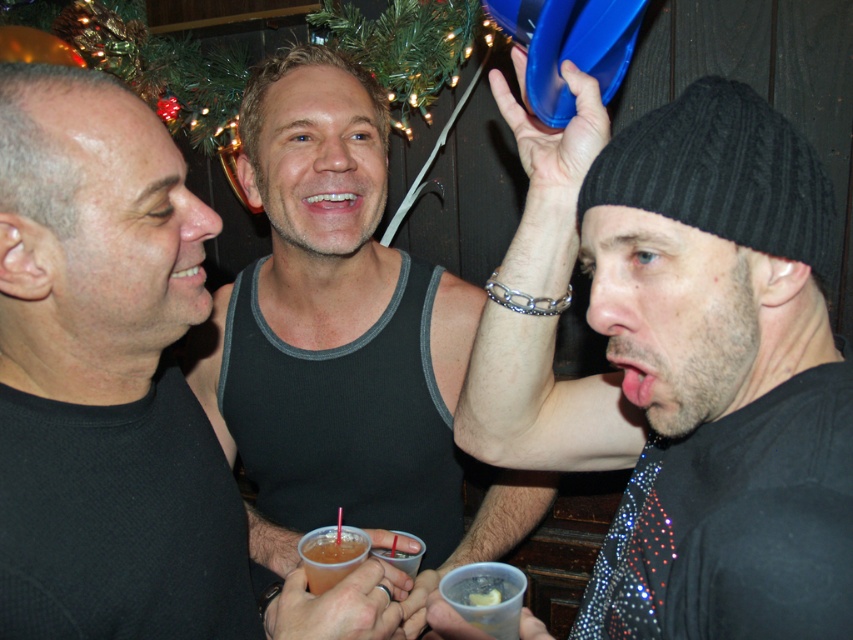
Question: Estimate the real-world distances between objects in this image. Which object is closer to the black matte tank top at upper center?

Choices:
 (A) black tank top at center
 (B) translucent plastic cup at center

Answer: (B)

Question: Observing the image, what is the correct spatial positioning of black matte tank top at upper center in reference to black knitted beanie at upper right?

Choices:
 (A) left
 (B) right

Answer: (A)

Question: Which point is farther from the camera taking this photo?

Choices:
 (A) (471, 412)
 (B) (700, 90)
 (C) (512, 593)

Answer: (A)

Question: In this image, where is black sparkly shirt at right located relative to clear plastic cup at lower center?

Choices:
 (A) below
 (B) above

Answer: (B)

Question: Is black sparkly shirt at right to the left of translucent plastic cup at center from the viewer's perspective?

Choices:
 (A) no
 (B) yes

Answer: (A)

Question: Among these points, which one is farthest from the camera?

Choices:
 (A) (686, 147)
 (B) (62, 150)

Answer: (B)